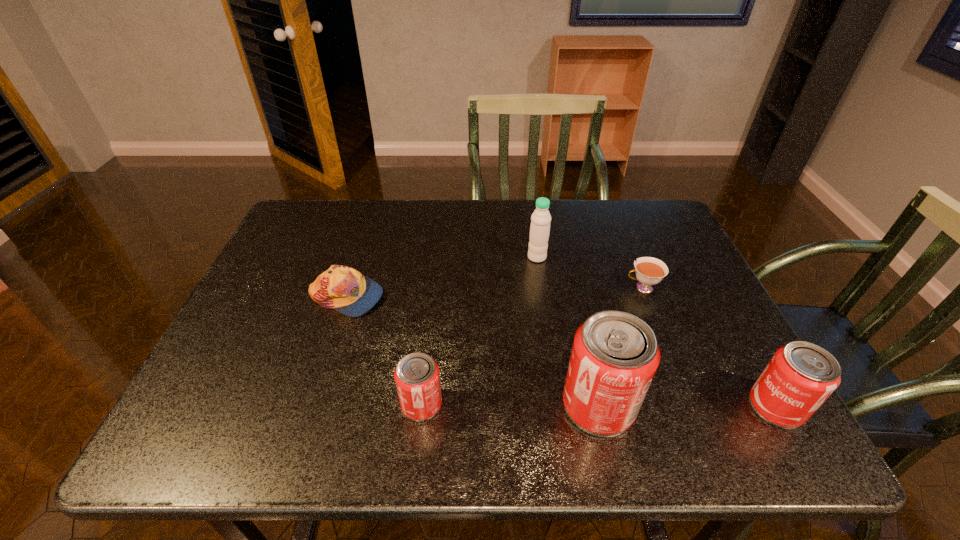
The width and height of the screenshot is (960, 540). What are the coordinates of `vacant position in the image that satisfies the following two spatial constraints: 1. on the bill of the leftmost object; 2. on the back side of the second can from left to right` in the screenshot? It's located at (312, 406).

Find the location of `free space that satisfies the following two spatial constraints: 1. on the bill of the leftmost object; 2. on the back side of the fifth object from right to left`. free space that satisfies the following two spatial constraints: 1. on the bill of the leftmost object; 2. on the back side of the fifth object from right to left is located at coordinates (312, 404).

You are a GUI agent. You are given a task and a screenshot of the screen. Output one action in this format:
    pyautogui.click(x=<x>, y=<y>)
    Task: Click on the free space that satisfies the following two spatial constraints: 1. on the bill of the leftmost object; 2. on the right side of the fourth shortest object
    
    Given the screenshot: What is the action you would take?
    pyautogui.click(x=311, y=407)

Locate an element on the screen. The height and width of the screenshot is (540, 960). vacant space that satisfies the following two spatial constraints: 1. on the side of the teacup with the handle; 2. on the front side of the third shortest object is located at coordinates (688, 404).

Where is `vacant space that satisfies the following two spatial constraints: 1. on the front side of the shortest can; 2. on the right side of the tallest can`? This screenshot has width=960, height=540. vacant space that satisfies the following two spatial constraints: 1. on the front side of the shortest can; 2. on the right side of the tallest can is located at coordinates (421, 406).

Locate an element on the screen. vacant space that satisfies the following two spatial constraints: 1. on the back side of the second shortest can; 2. on the bill of the cap is located at coordinates (714, 297).

This screenshot has width=960, height=540. Find the location of `free region that satisfies the following two spatial constraints: 1. on the side of the teacup with the handle; 2. on the front side of the tallest can`. free region that satisfies the following two spatial constraints: 1. on the side of the teacup with the handle; 2. on the front side of the tallest can is located at coordinates (689, 406).